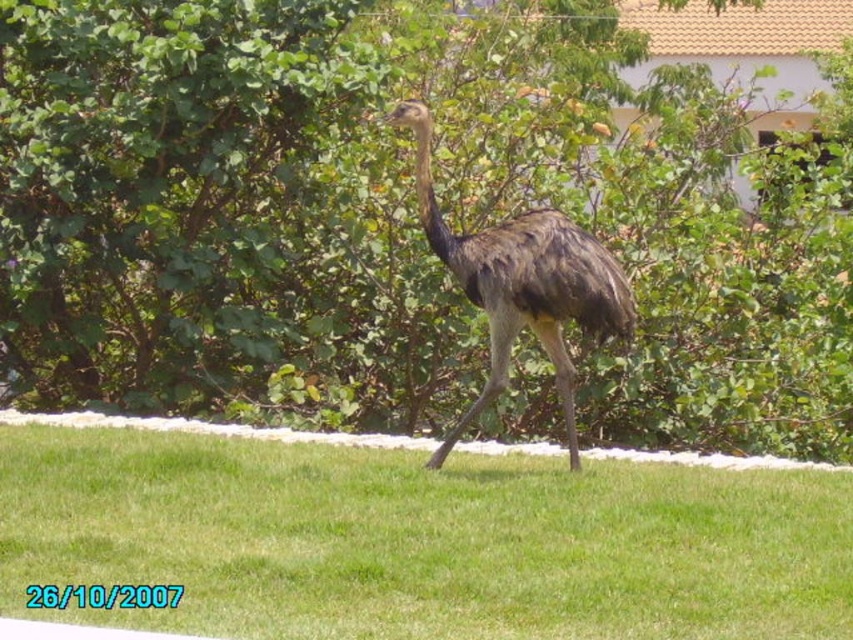
Question: Does green grass at center come in front of brown feathered ostrich at center?

Choices:
 (A) no
 (B) yes

Answer: (B)

Question: Is green leafy tree at center below green grass at center?

Choices:
 (A) no
 (B) yes

Answer: (A)

Question: Which point is farther to the camera?

Choices:
 (A) (486, 38)
 (B) (456, 602)
 (C) (592, 314)

Answer: (A)

Question: Does green leafy tree at center appear on the left side of green grass at center?

Choices:
 (A) no
 (B) yes

Answer: (A)

Question: Which is nearer to the green leafy tree at center?

Choices:
 (A) brown feathered ostrich at center
 (B) green grass at center

Answer: (B)

Question: Which of the following is the closest to the observer?

Choices:
 (A) green leafy tree at center
 (B) green grass at center
 (C) brown feathered ostrich at center

Answer: (B)